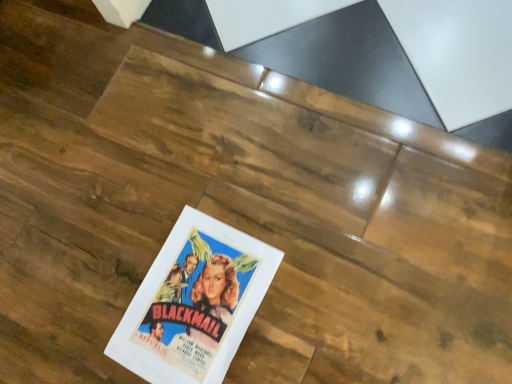
The height and width of the screenshot is (384, 512). I want to click on free area below matte paper poster at center (from a real-world perspective), so click(x=191, y=299).